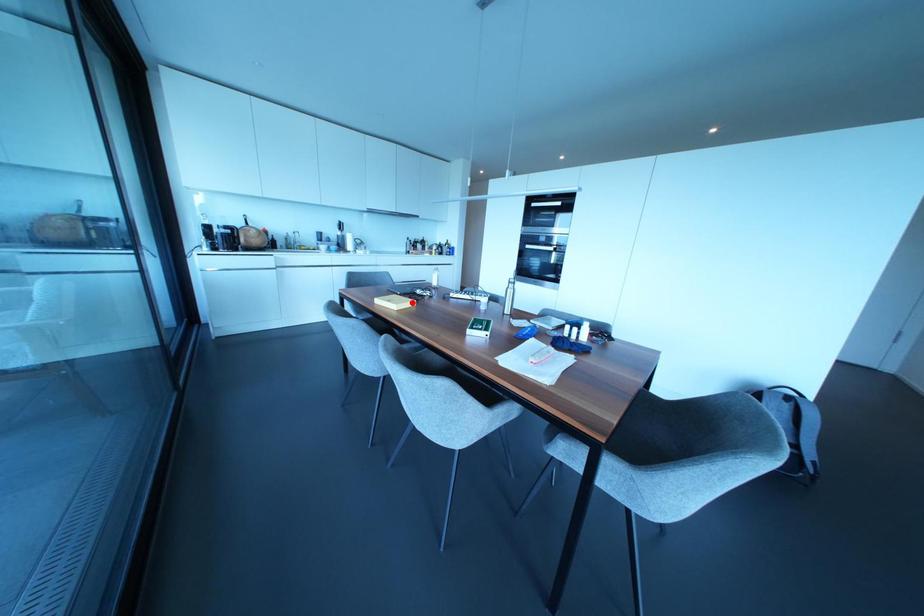
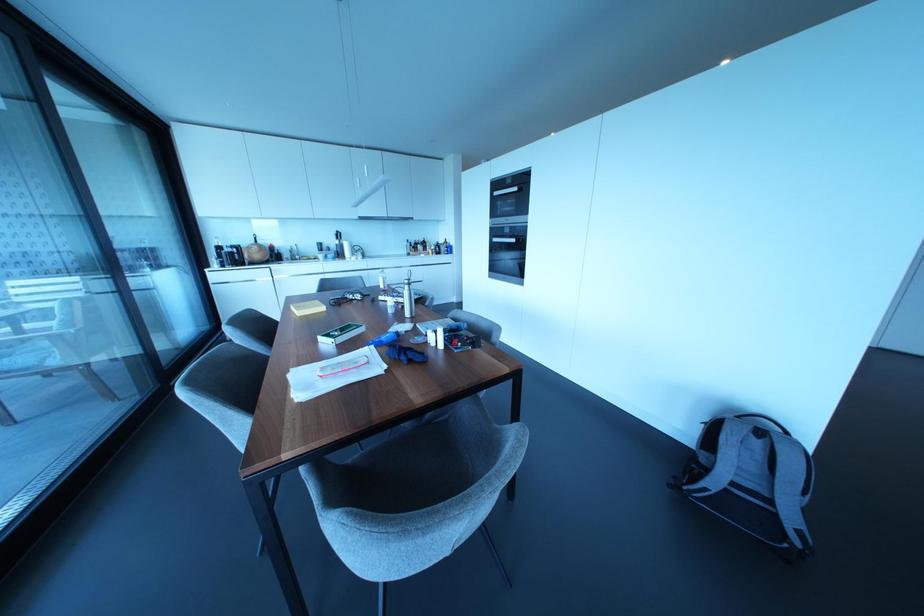
The point at the highlighted location is marked in the first image. Where is the corresponding point in the second image?

(322, 308)